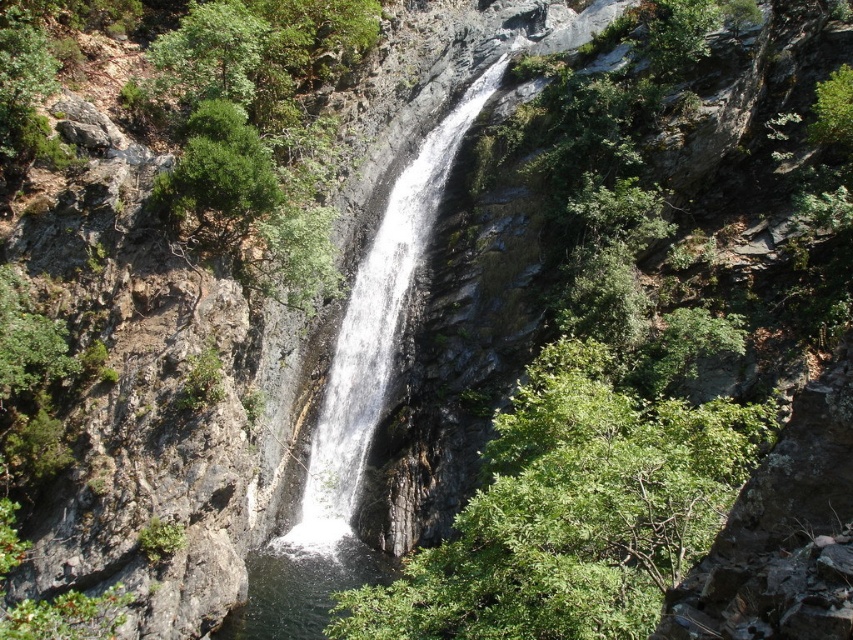
Can you confirm if white frothy water at center is positioned below clear water at center?

No, white frothy water at center is not below clear water at center.

Can you confirm if white frothy water at center is positioned to the left of clear water at center?

In fact, white frothy water at center is to the right of clear water at center.

Is point (503, 67) behind point (325, 589)?

Yes, it is.

Where is `white frothy water at center`? white frothy water at center is located at coordinates (376, 326).